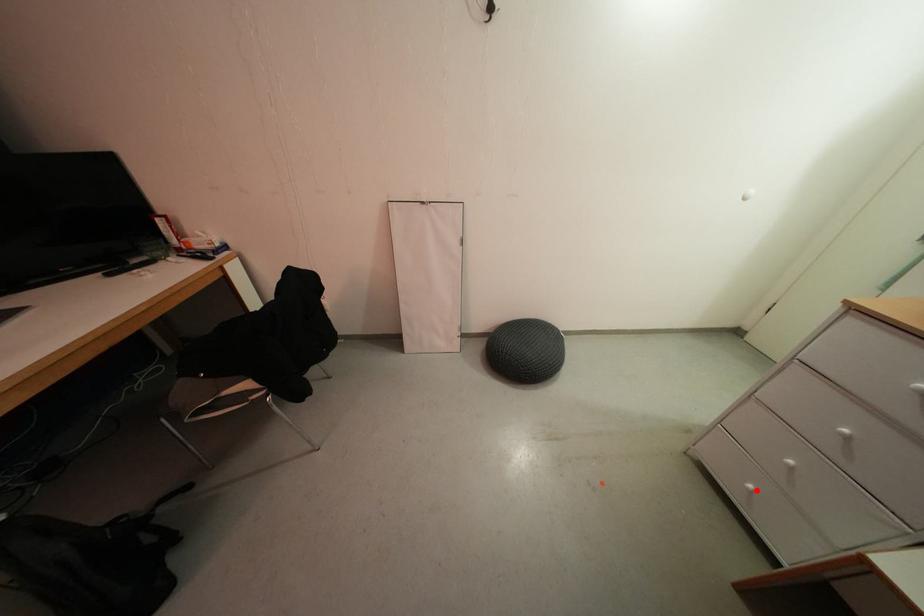
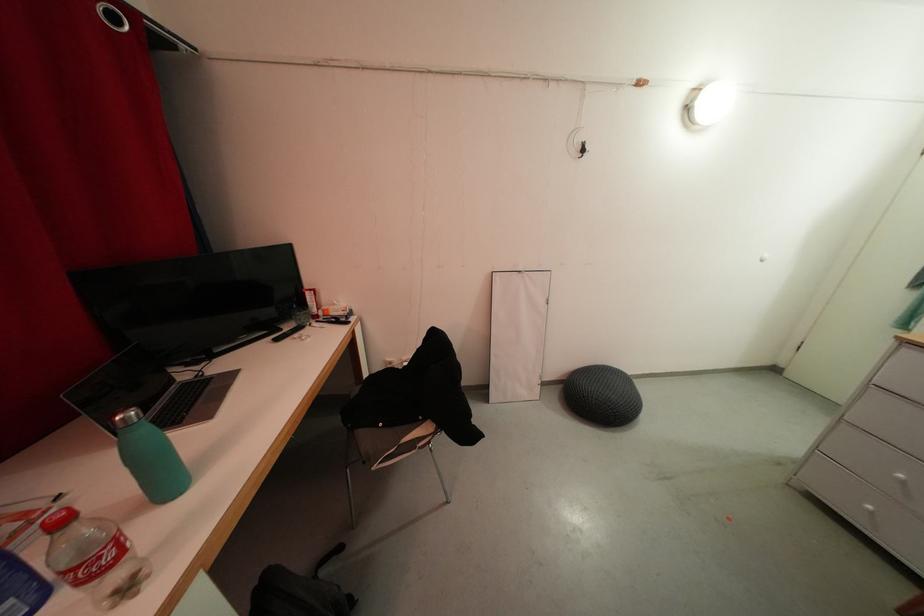
Find the pixel in the second image that matches the highlighted location in the first image.

(874, 511)